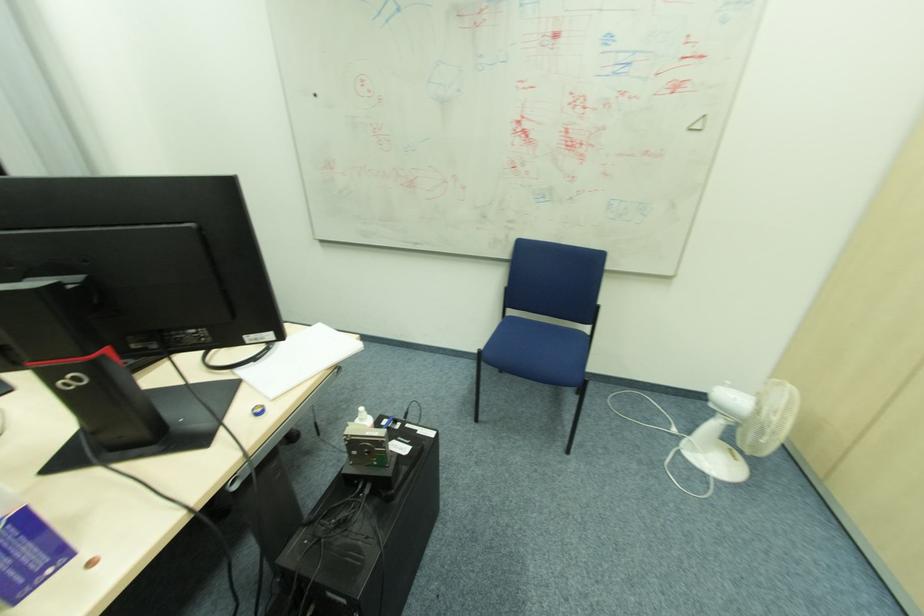
Find where to press the white portable fan switch. Please return your answer as a coordinate pair (x, y).

(726, 383)